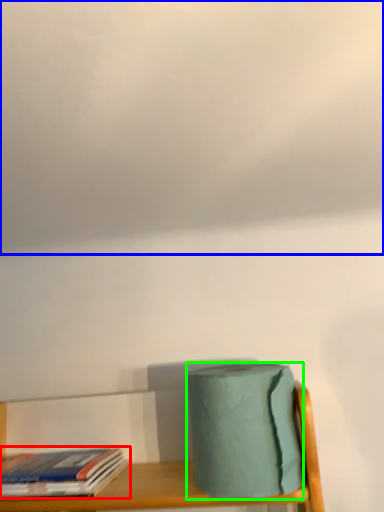
Question: Which object is the farthest from book (highlighted by a red box)? Choose among these: cloud (highlighted by a blue box) or toilet paper (highlighted by a green box).

Choices:
 (A) cloud
 (B) toilet paper

Answer: (A)